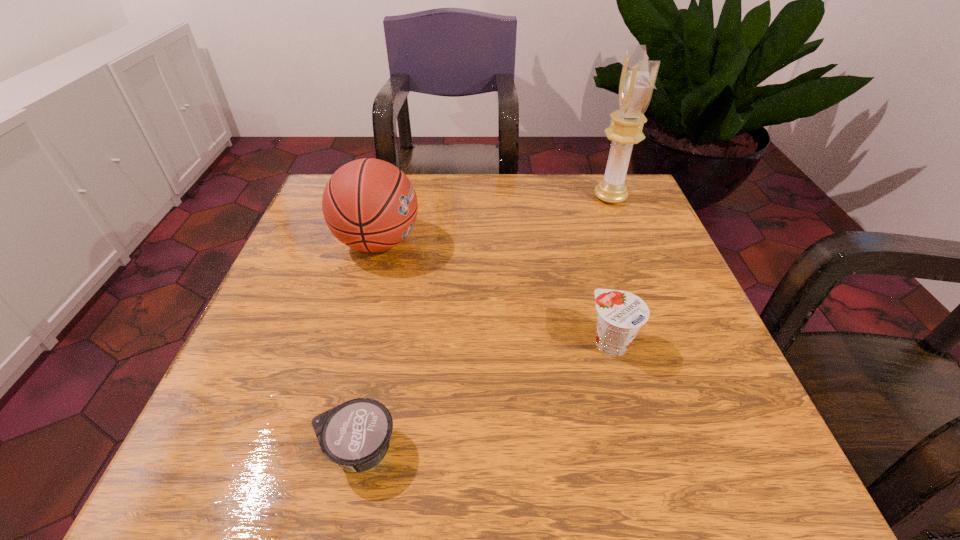
The image size is (960, 540). What are the coordinates of `object that is at the far left corner` in the screenshot? It's located at (370, 205).

Where is `object that is at the far right corner`? This screenshot has width=960, height=540. object that is at the far right corner is located at coordinates (638, 76).

Where is `vacant space at the far edge`? vacant space at the far edge is located at coordinates (490, 213).

The height and width of the screenshot is (540, 960). What are the coordinates of `vacant space at the near edge of the desktop` in the screenshot? It's located at (545, 474).

In the image, there is a desktop. Identify the location of vacant space at the left edge. The height and width of the screenshot is (540, 960). (288, 338).

In the image, there is a desktop. At what (x,y) coordinates should I click in order to perform the action: click on vacant space at the right edge. Please return your answer as a coordinate pair (x, y). Looking at the image, I should click on (601, 252).

The image size is (960, 540). Find the location of `vacant space at the near left corner of the desktop`. vacant space at the near left corner of the desktop is located at coordinates (240, 483).

Identify the location of vacant area at the near right corner of the desktop. [694, 431].

The height and width of the screenshot is (540, 960). In order to click on vacant point located between the shorter yogurt and the second shortest object in this screenshot , I will do `click(485, 396)`.

The width and height of the screenshot is (960, 540). Identify the location of free space between the second tallest object and the rightmost object. (494, 220).